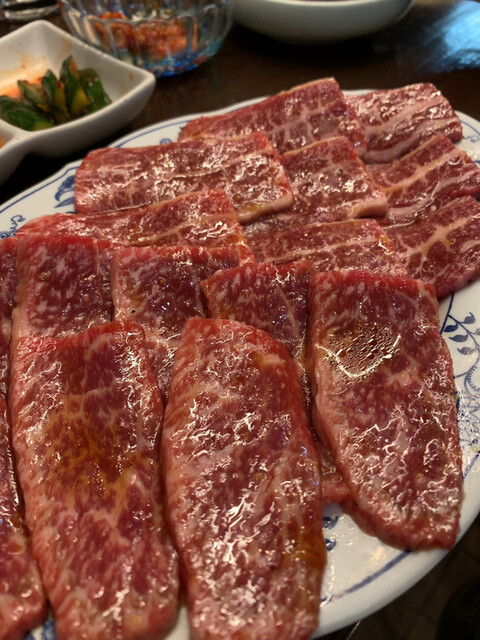
At what (x,y) coordinates should I click in order to perform the action: click on tiled floor. Please return your answer as a coordinate pair (x, y). The width and height of the screenshot is (480, 640). Looking at the image, I should click on pyautogui.click(x=407, y=616).